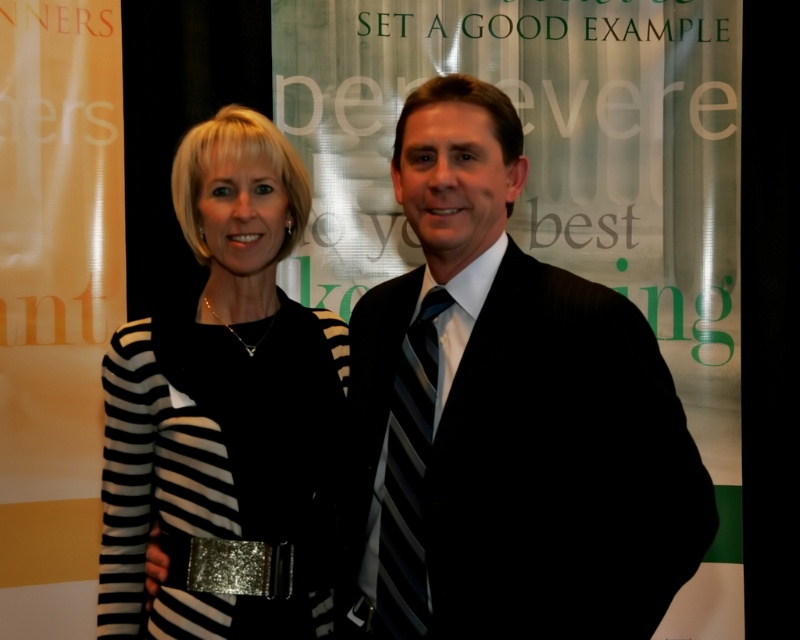
Which is in front, point (541, 349) or point (200, 220)?

Point (541, 349) is more forward.

Measure the distance between black striped suit at center and camera.

They are 1.32 meters apart.

This screenshot has width=800, height=640. I want to click on black striped suit at center, so click(505, 417).

Does black striped dress at center appear over black striped tie at center?

Correct, black striped dress at center is located above black striped tie at center.

Is point (258, 269) in front of point (420, 403)?

No, (258, 269) is further to viewer.

Where is `black striped dress at center`? black striped dress at center is located at coordinates (226, 413).

Is point (440, 280) positioned after point (408, 632)?

Yes, point (440, 280) is behind point (408, 632).

Who is lower down, black striped suit at center or black striped tie at center?

black striped tie at center is lower down.

What are the coordinates of `black striped suit at center` in the screenshot? It's located at (505, 417).

What are the coordinates of `black striped suit at center` in the screenshot? It's located at (505, 417).